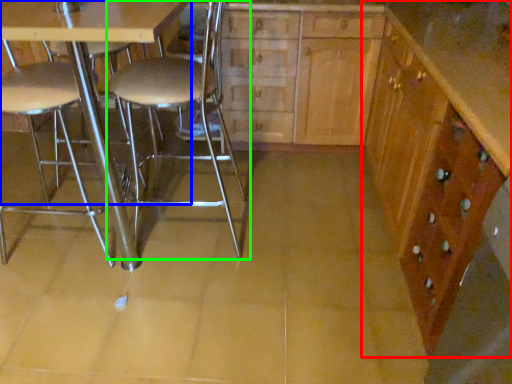
Question: Considering the real-world distances, which object is farthest from cabinetry (highlighted by a red box)? table (highlighted by a blue box) or chair (highlighted by a green box)?

Choices:
 (A) table
 (B) chair

Answer: (A)